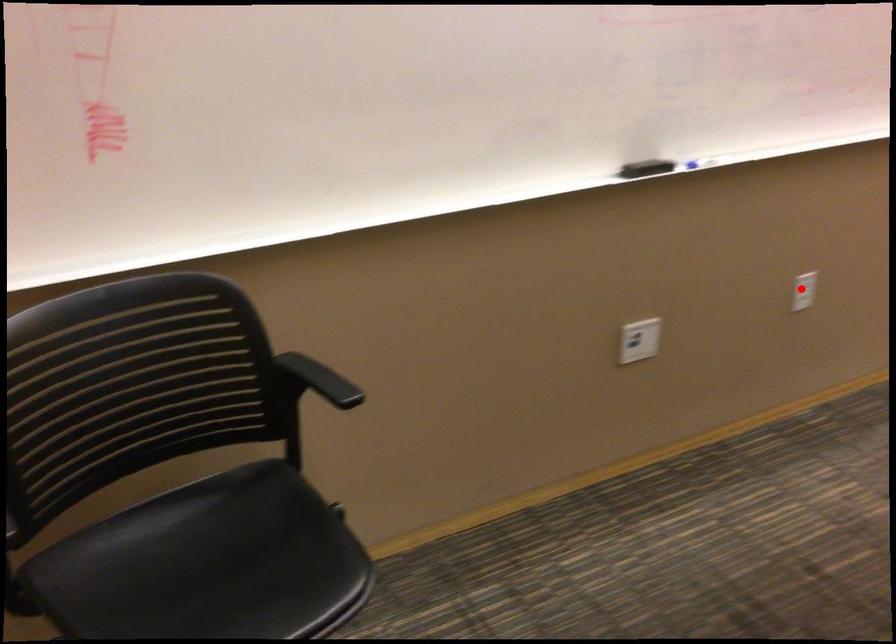
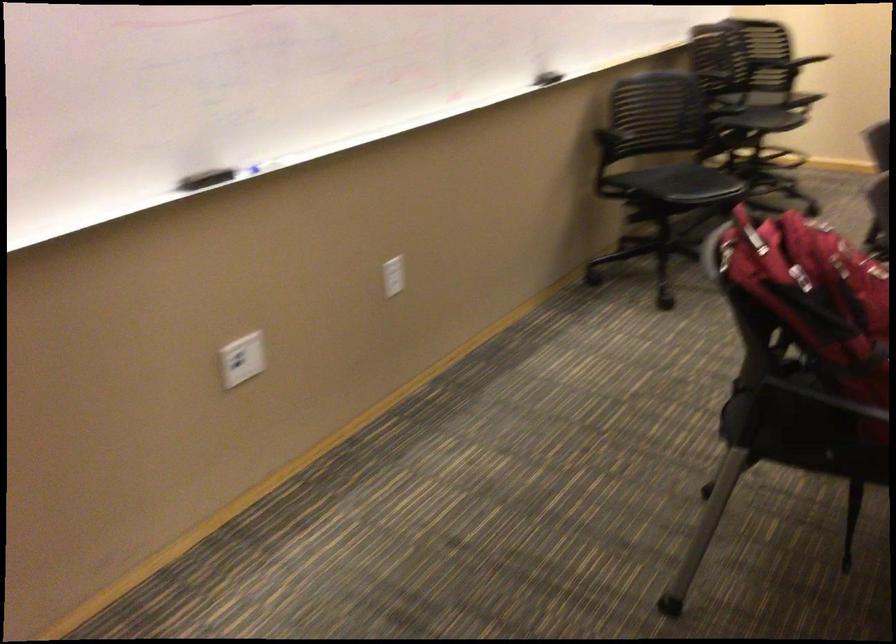
In the second image, find the point that corresponds to the highlighted location in the first image.

(392, 276)